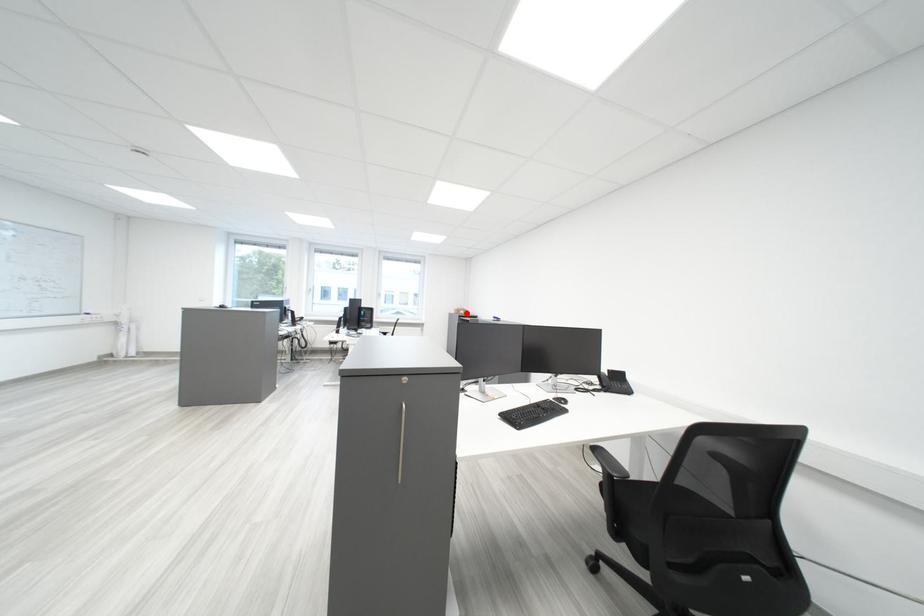
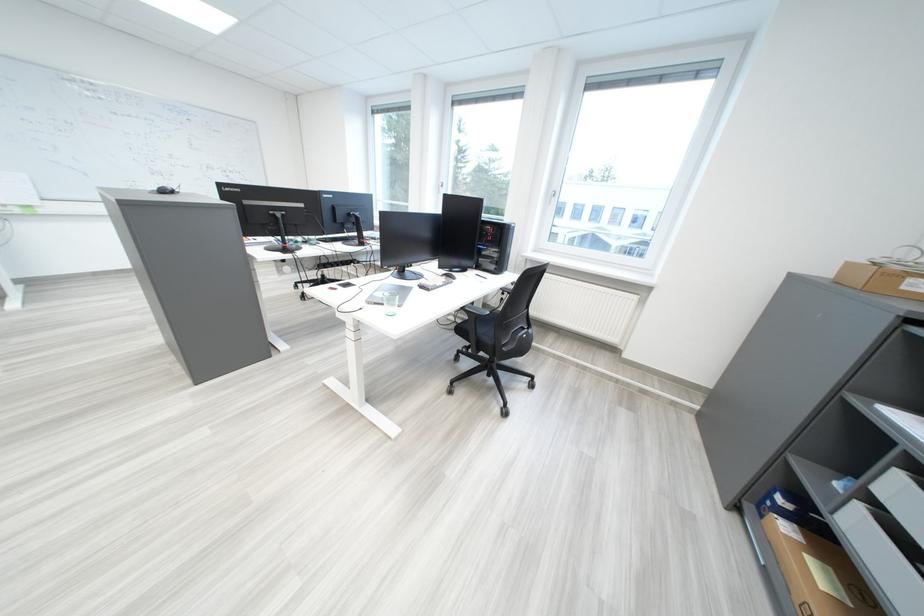
Find the pixel in the second image that matches the highlighted location in the first image.

(839, 274)